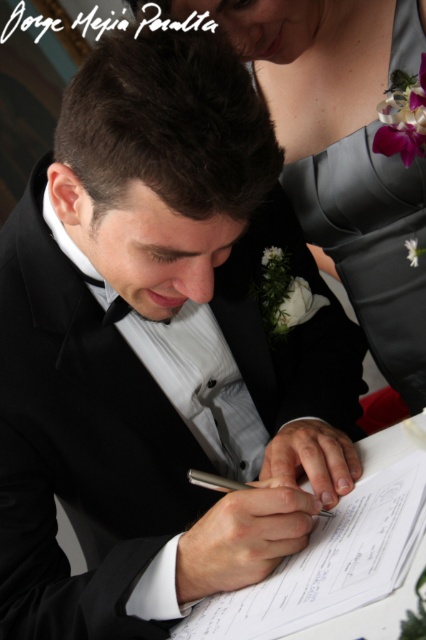
You are an event planner standing at the center of the scene. You need to place a decorative centerpiece on the table between the man in the black tuxedo and the satin gray dress at upper right. Where should you position it to be equidistant from both?

The satin gray dress at upper right is located at point (345, 150). To place the centerpiece equidistant between the man and the dress, calculate the midpoint between their positions. Since the man is centrally positioned, the midpoint would be halfway between the center of the scene and the coordinates of the dress. This ensures the centerpiece is equally distant from both figures.

You are standing at the point with coordinates point (x=212, y=474) and want to move to the point with coordinates point (x=267, y=4). Is the point you want to reach in front of or behind you?

The point with coordinates point (x=267, y=4) is behind point (x=212, y=474), so the destination is behind your current position.